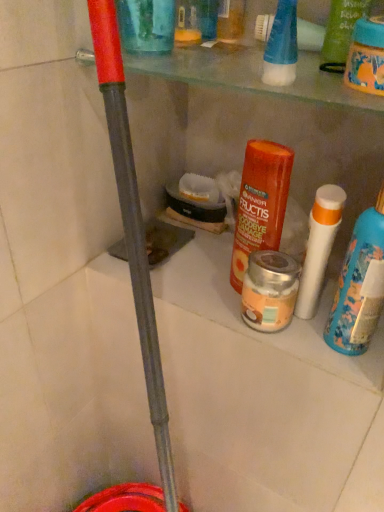
Question: From the image's perspective, is green matte shampoo at upper right, the 4th product in the left-to-right sequence, located above white matte bottle at right?

Choices:
 (A) yes
 (B) no

Answer: (A)

Question: Does green matte shampoo at upper right, the 4th product in the left-to-right sequence, appear on the left side of white matte bottle at right?

Choices:
 (A) no
 (B) yes

Answer: (B)

Question: Is white matte bottle at right located within green matte shampoo at upper right, positioned as the first product in right-to-left order?

Choices:
 (A) yes
 (B) no

Answer: (B)

Question: Could you tell me if green matte shampoo at upper right, positioned as the first product in right-to-left order, is turned towards white matte bottle at right?

Choices:
 (A) no
 (B) yes

Answer: (A)

Question: Can you confirm if green matte shampoo at upper right, positioned as the first product in right-to-left order, is taller than white matte bottle at right?

Choices:
 (A) yes
 (B) no

Answer: (B)

Question: Can you confirm if green matte shampoo at upper right, the 4th product in the left-to-right sequence, is smaller than white matte bottle at right?

Choices:
 (A) no
 (B) yes

Answer: (B)

Question: Is silver metallic jar at center, the 2th product in the right-to-left sequence, taller than transparent plastic cup at upper center, placed as the fourth product when sorted from right to left?

Choices:
 (A) no
 (B) yes

Answer: (A)

Question: Considering the relative sizes of silver metallic jar at center, which is the third product from left to right, and transparent plastic cup at upper center, the 1th product viewed from the left, in the image provided, is silver metallic jar at center, which is the third product from left to right, smaller than transparent plastic cup at upper center, the 1th product viewed from the left,?

Choices:
 (A) yes
 (B) no

Answer: (A)

Question: Can you confirm if silver metallic jar at center, the 2th product in the right-to-left sequence, is wider than transparent plastic cup at upper center, the 1th product viewed from the left?

Choices:
 (A) yes
 (B) no

Answer: (A)

Question: From a real-world perspective, does silver metallic jar at center, the 2th product in the right-to-left sequence, stand above transparent plastic cup at upper center, the 1th product viewed from the left?

Choices:
 (A) yes
 (B) no

Answer: (B)

Question: Is the position of silver metallic jar at center, which is the third product from left to right, more distant than that of transparent plastic cup at upper center, the 1th product viewed from the left?

Choices:
 (A) yes
 (B) no

Answer: (A)

Question: Is silver metallic jar at center, which is the third product from left to right, aimed at transparent plastic cup at upper center, the 1th product viewed from the left?

Choices:
 (A) no
 (B) yes

Answer: (A)

Question: Does orange matte haircare product at center, which appears as the second product when viewed from the left, have a lesser height compared to white matte bottle at right?

Choices:
 (A) no
 (B) yes

Answer: (B)